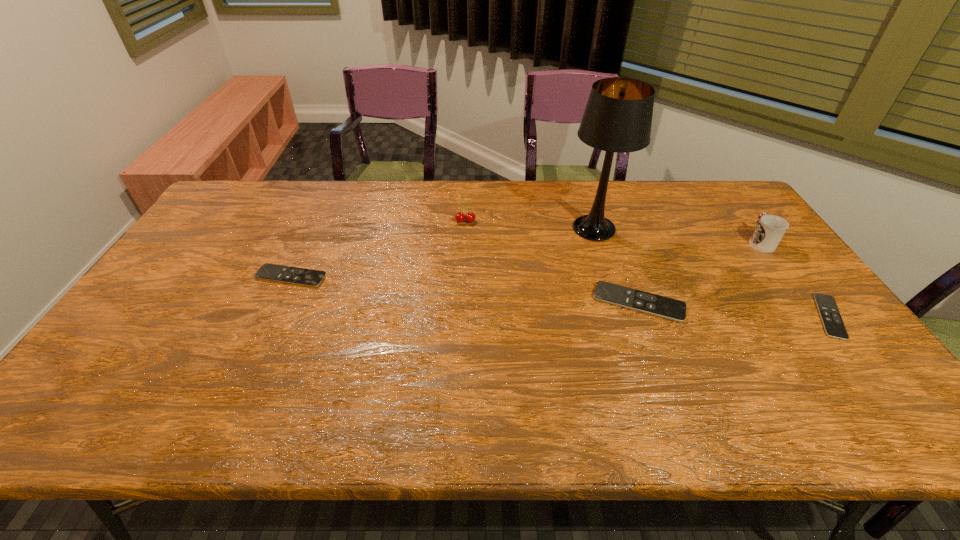
Locate an element on the screen. The width and height of the screenshot is (960, 540). free space between the fourth tallest object and the shortest remote control is located at coordinates (734, 309).

The height and width of the screenshot is (540, 960). In order to click on vacant region between the tallest object and the fifth tallest object in this screenshot , I will do `click(443, 252)`.

Identify the location of vacant area between the cup and the rightmost remote control. (795, 279).

Locate an element on the screen. The width and height of the screenshot is (960, 540). vacant space that is in between the fourth tallest object and the leftmost remote control is located at coordinates (465, 289).

Identify the location of vacant area between the tallest remote control and the cherry. The height and width of the screenshot is (540, 960). (552, 262).

Image resolution: width=960 pixels, height=540 pixels. Find the location of `vacant point located between the cup and the tallest remote control`. vacant point located between the cup and the tallest remote control is located at coordinates (699, 272).

The height and width of the screenshot is (540, 960). Identify the location of free space between the second tallest remote control and the fourth tallest object. point(465,289).

Identify which object is the second nearest to the second object from left to right. Please provide its 2D coordinates. Your answer should be formatted as a tuple, i.e. [(x, y)], where the tuple contains the x and y coordinates of a point satisfying the conditions above.

[(272, 272)]

Point out which object is positioned as the third nearest to the third shortest object. Please provide its 2D coordinates. Your answer should be formatted as a tuple, i.e. [(x, y)], where the tuple contains the x and y coordinates of a point satisfying the conditions above.

[(770, 229)]

This screenshot has height=540, width=960. In order to click on remote control that stands as the second closest to the cup in this screenshot , I will do `click(668, 308)`.